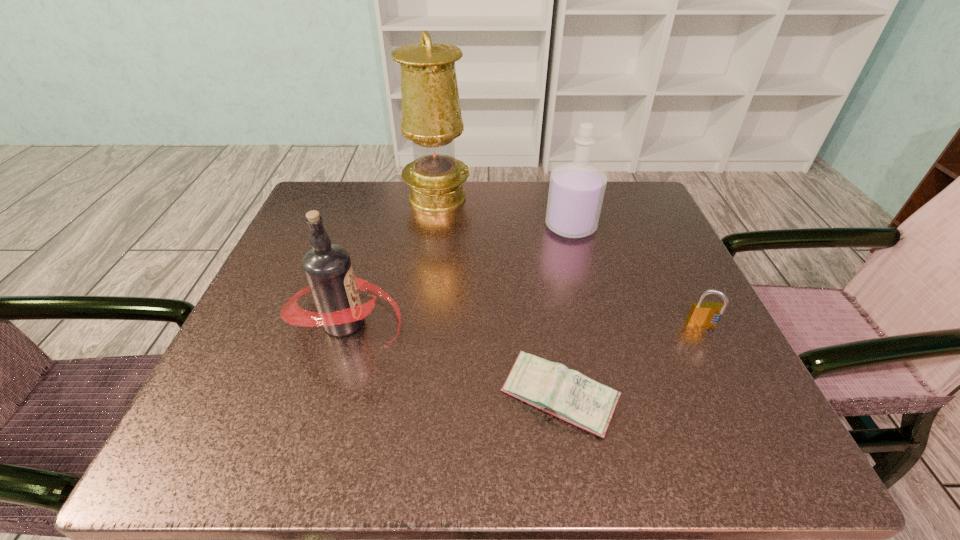
Find the location of a particular element. The height and width of the screenshot is (540, 960). oil lamp is located at coordinates click(431, 115).

The image size is (960, 540). In order to click on perfume in this screenshot , I will do `click(576, 191)`.

Identify the location of root beer. (327, 267).

Where is `padlock`? padlock is located at coordinates (701, 314).

This screenshot has height=540, width=960. I want to click on the fourth tallest object, so click(701, 314).

Identify the location of diary. The width and height of the screenshot is (960, 540). (552, 387).

Where is `vacant space located on the right of the oil lamp`? vacant space located on the right of the oil lamp is located at coordinates (578, 198).

You are a GUI agent. You are given a task and a screenshot of the screen. Output one action in this format:
    pyautogui.click(x=<x>, y=<y>)
    Task: Click on the free space located 0.220m on the left of the perfume
    
    Given the screenshot: What is the action you would take?
    pyautogui.click(x=446, y=226)

You are a GUI agent. You are given a task and a screenshot of the screen. Output one action in this format:
    pyautogui.click(x=<x>, y=<y>)
    Task: Click on the vacant space located on the label of the root beer
    
    Given the screenshot: What is the action you would take?
    pyautogui.click(x=507, y=322)

You are a GUI agent. You are given a task and a screenshot of the screen. Output one action in this format:
    pyautogui.click(x=<x>, y=<y>)
    Task: Click on the vacant point located 0.100m on the side with the combination dials of the rightmost object
    
    Given the screenshot: What is the action you would take?
    pyautogui.click(x=732, y=384)